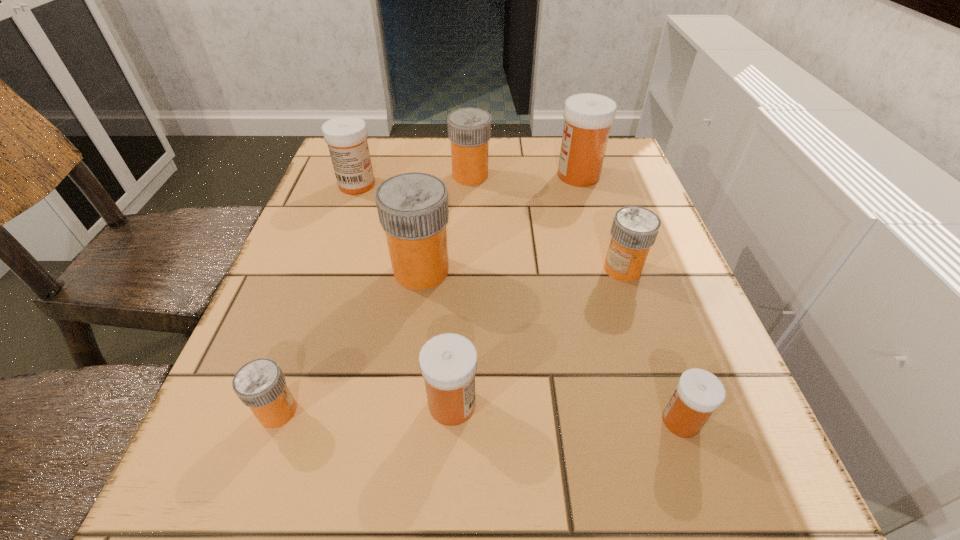
Locate an element on the screen. medicine that is the sixth closest to the biggest orange medicine is located at coordinates coord(588,117).

Locate which white medicine is the second closest to the biggest orange medicine. Please provide its 2D coordinates. Your answer should be formatted as a tuple, i.e. [(x, y)], where the tuple contains the x and y coordinates of a point satisfying the conditions above.

[(346, 136)]

Point out which white medicine is positioned as the third nearest to the third biggest white medicine. Please provide its 2D coordinates. Your answer should be formatted as a tuple, i.e. [(x, y)], where the tuple contains the x and y coordinates of a point satisfying the conditions above.

[(588, 117)]

Select which orange medicine appears as the second closest to the rightmost orange medicine. Please provide its 2D coordinates. Your answer should be formatted as a tuple, i.e. [(x, y)], where the tuple contains the x and y coordinates of a point satisfying the conditions above.

[(469, 129)]

Where is `orange medicine object that ranks as the closest to the nearest orange medicine`? The image size is (960, 540). orange medicine object that ranks as the closest to the nearest orange medicine is located at coordinates (413, 211).

This screenshot has width=960, height=540. Identify the location of blank space that satisfies the following two spatial constraints: 1. on the label side of the farthest orange medicine; 2. on the back side of the smallest white medicine. (464, 421).

This screenshot has height=540, width=960. Find the location of `blank area in the image that satisfies the following two spatial constraints: 1. on the front side of the third biggest white medicine; 2. on the right side of the second biggest white medicine`. blank area in the image that satisfies the following two spatial constraints: 1. on the front side of the third biggest white medicine; 2. on the right side of the second biggest white medicine is located at coordinates (279, 404).